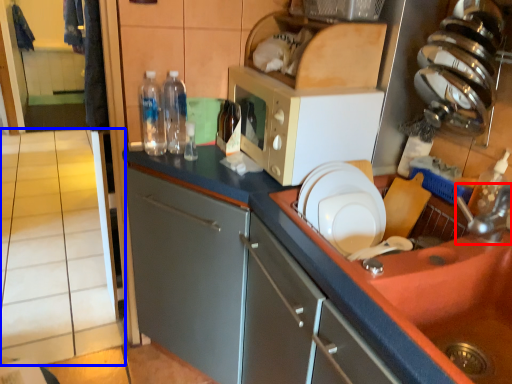
Question: Which of the following is the farthest to the observer, faucet (highlighted by a red box) or tile (highlighted by a blue box)?

Choices:
 (A) faucet
 (B) tile

Answer: (B)